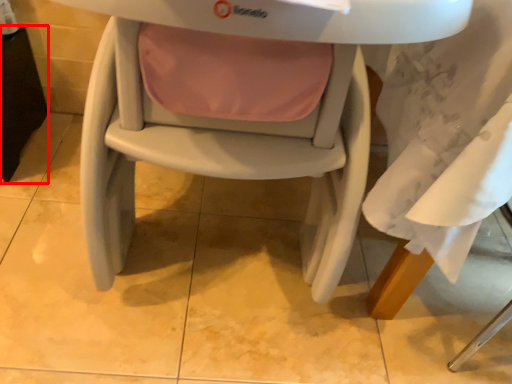
Question: From the image's perspective, what is the correct spatial relationship of table (annotated by the red box) in relation to chair?

Choices:
 (A) below
 (B) above

Answer: (B)